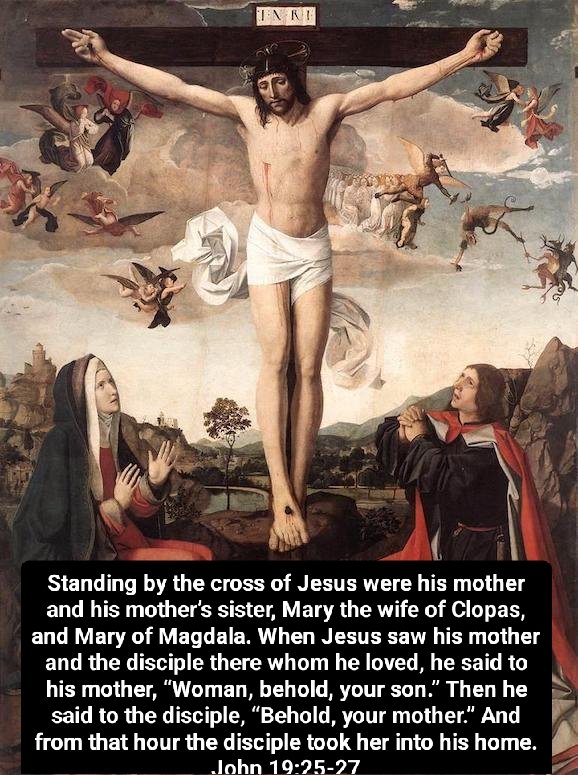
You are a GUI agent. You are given a task and a screenshot of the screen. Output one action in this format:
    pyautogui.click(x=<x>, y=<y>)
    Task: Click on the crucifix
    The height and width of the screenshot is (775, 578).
    Given the screenshot: What is the action you would take?
    pyautogui.click(x=344, y=46)